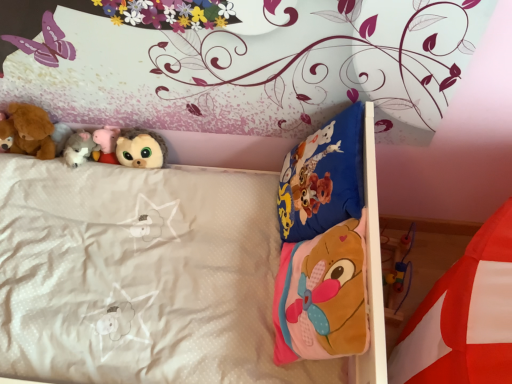
Question: Is white plush toy at upper left, the third toy when ordered from right to left, positioned beyond the bounds of soft pink fabric mattress at lower right?

Choices:
 (A) yes
 (B) no

Answer: (A)

Question: From a real-world perspective, is white plush toy at upper left, arranged as the third toy when viewed from the left, on top of soft pink fabric mattress at lower right?

Choices:
 (A) no
 (B) yes

Answer: (A)

Question: Does white plush toy at upper left, the third toy when ordered from right to left, come behind soft pink fabric mattress at lower right?

Choices:
 (A) yes
 (B) no

Answer: (A)

Question: Is white plush toy at upper left, the third toy when ordered from right to left, in contact with soft pink fabric mattress at lower right?

Choices:
 (A) yes
 (B) no

Answer: (B)

Question: Could soft pink fabric mattress at lower right be considered to be inside white plush toy at upper left, arranged as the third toy when viewed from the left?

Choices:
 (A) yes
 (B) no

Answer: (B)

Question: From the image's perspective, is soft brown teddy bear at left, which appears as the 2th toy when viewed from the left, above or below white plush toy at upper left, the third toy when ordered from right to left?

Choices:
 (A) above
 (B) below

Answer: (A)

Question: From a real-world perspective, is soft brown teddy bear at left, the 4th toy from the right, positioned above or below white plush toy at upper left, the third toy when ordered from right to left?

Choices:
 (A) above
 (B) below

Answer: (A)

Question: Is soft brown teddy bear at left, the 4th toy from the right, inside the boundaries of white plush toy at upper left, arranged as the third toy when viewed from the left, or outside?

Choices:
 (A) inside
 (B) outside

Answer: (B)

Question: Based on their positions, is soft brown teddy bear at left, the 4th toy from the right, located to the left or right of white plush toy at upper left, the third toy when ordered from right to left?

Choices:
 (A) left
 (B) right

Answer: (A)

Question: Is point [138, 160] positioned closer to the camera than point [38, 107]?

Choices:
 (A) closer
 (B) farther

Answer: (B)

Question: Considering the positions of fluffy brown plush at upper center, positioned as the first toy in right-to-left order, and soft brown teddy bear at left, the 4th toy from the right, in the image, is fluffy brown plush at upper center, positioned as the first toy in right-to-left order, taller or shorter than soft brown teddy bear at left, the 4th toy from the right,?

Choices:
 (A) short
 (B) tall

Answer: (A)

Question: Is fluffy brown plush at upper center, positioned as the first toy in right-to-left order, in front of or behind soft brown teddy bear at left, the 4th toy from the right, in the image?

Choices:
 (A) front
 (B) behind

Answer: (B)

Question: From a real-world perspective, relative to soft brown teddy bear at left, which appears as the 2th toy when viewed from the left, is fluffy brown plush at upper center, arranged as the 5th toy when viewed from the left, vertically above or below?

Choices:
 (A) below
 (B) above

Answer: (A)

Question: From the image's perspective, is pink plush pig at upper left, the second toy in the right-to-left sequence, positioned above or below soft brown teddy bear at left, the 4th toy from the right?

Choices:
 (A) above
 (B) below

Answer: (B)

Question: Considering the positions of point (114, 162) and point (47, 115), is point (114, 162) closer or farther from the camera than point (47, 115)?

Choices:
 (A) farther
 (B) closer

Answer: (A)